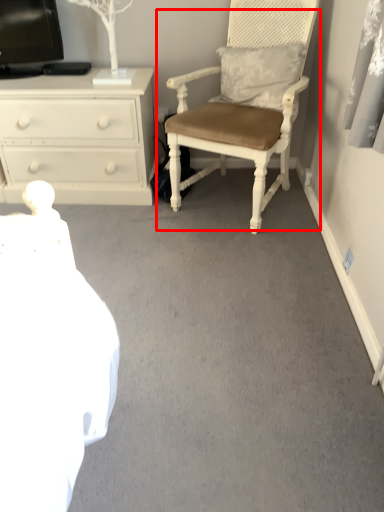
Question: From the image's perspective, where is chair (annotated by the red box) located in relation to chest of drawers in the image?

Choices:
 (A) above
 (B) below

Answer: (A)